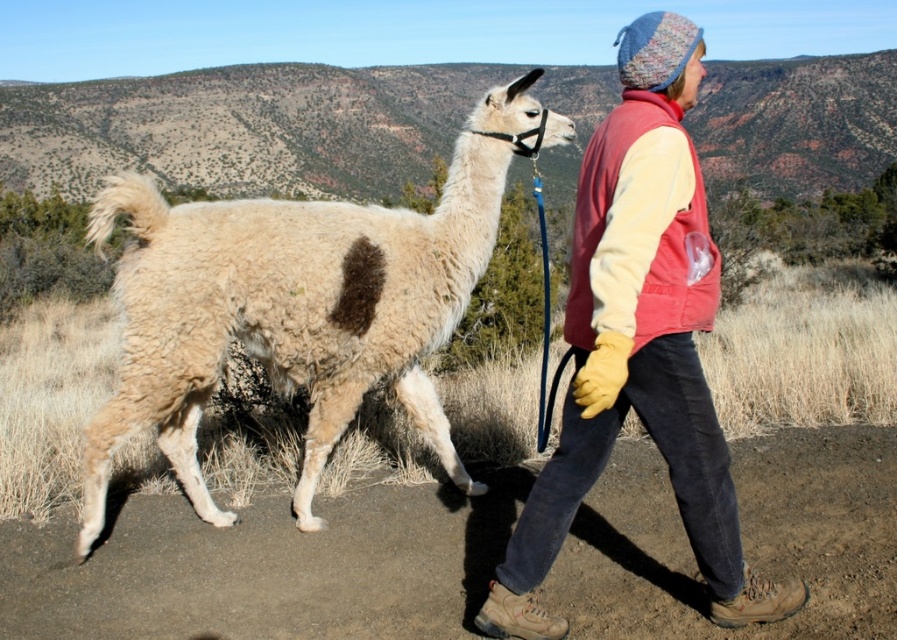
Does white woolen alpaca at center have a greater width compared to knitted wool hat at upper right?

Incorrect, white woolen alpaca at center's width does not surpass knitted wool hat at upper right's.

Who is lower down, white woolen alpaca at center or knitted wool hat at upper right?

white woolen alpaca at center

Is point (453, 211) positioned in front of point (631, 83)?

No.

Find the location of a particular element. white woolen alpaca at center is located at coordinates (299, 304).